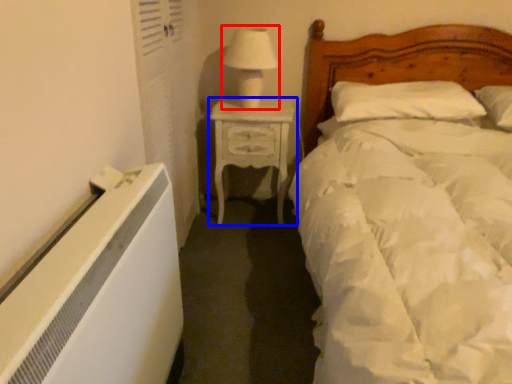
Question: Which of the following is the closest to the observer, table lamp (highlighted by a red box) or nightstand (highlighted by a blue box)?

Choices:
 (A) table lamp
 (B) nightstand

Answer: (A)